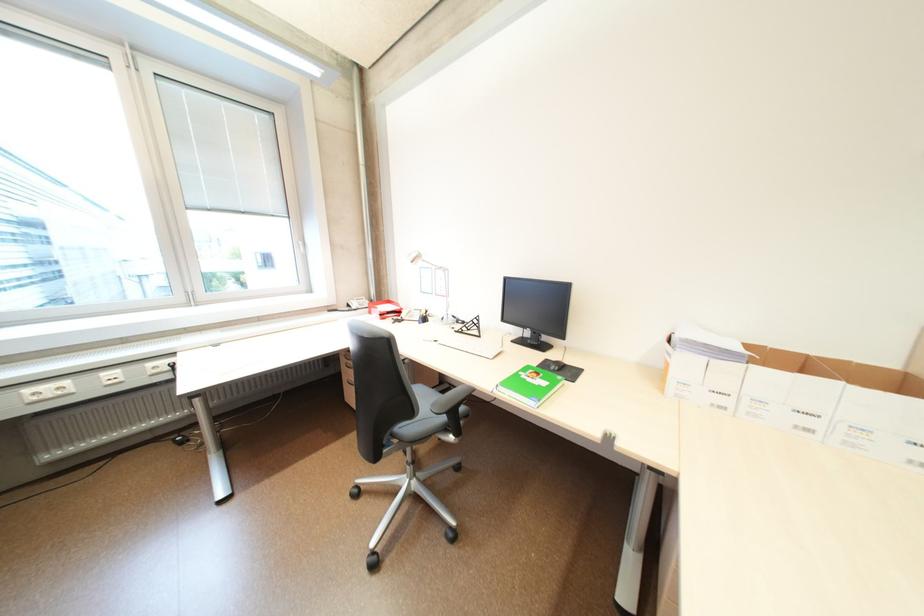
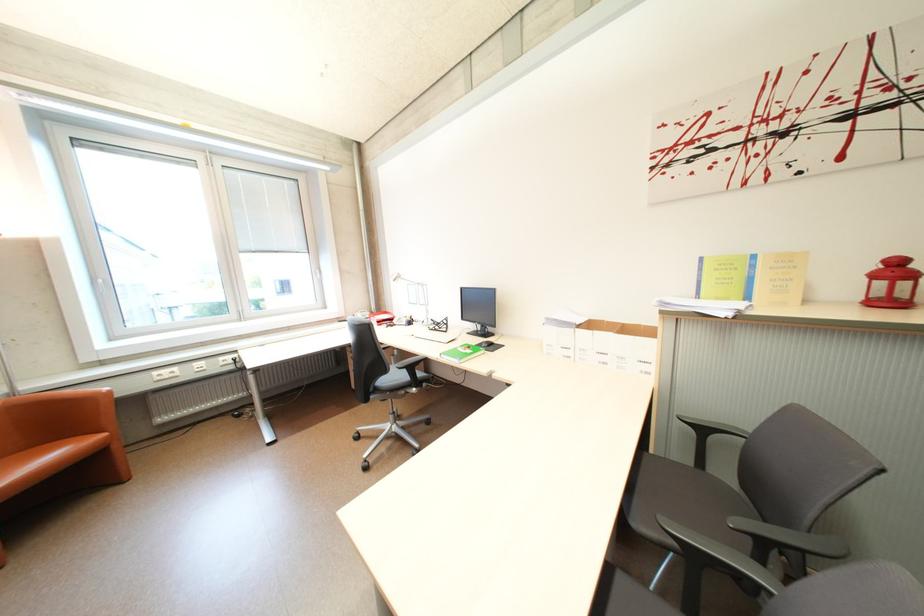
In a continuous first-person perspective shot, in which direction is the camera moving?

The cameraman moved toward right, backward.